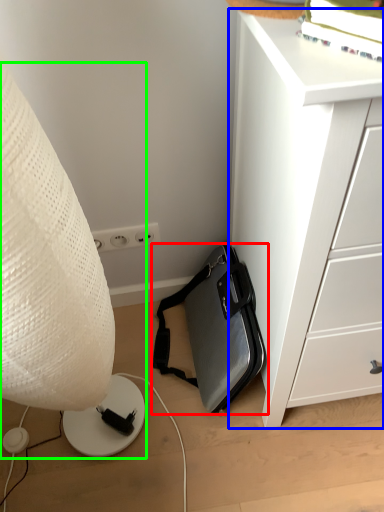
Question: Estimate the real-world distances between objects in this image. Which object is farther from luggage and bags (highlighted by a red box), chest of drawers (highlighted by a blue box) or lamp (highlighted by a green box)?

Choices:
 (A) chest of drawers
 (B) lamp

Answer: (B)